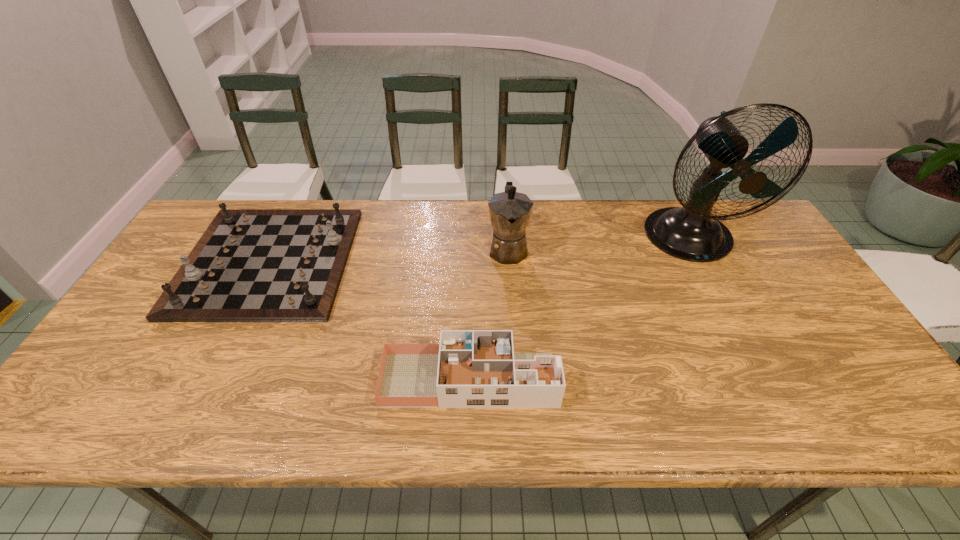
In the image, there is a desktop. Where is `vacant space at the right edge`? vacant space at the right edge is located at coordinates (791, 277).

Find the location of a particular element. This screenshot has width=960, height=540. free point between the chessboard and the fan is located at coordinates (479, 250).

You are a GUI agent. You are given a task and a screenshot of the screen. Output one action in this format:
    pyautogui.click(x=<x>, y=<y>)
    Task: Click on the unoccupied area between the dollhouse and the coffeepot
    The image size is (960, 540).
    Given the screenshot: What is the action you would take?
    pyautogui.click(x=489, y=314)

Locate an element on the screen. The image size is (960, 540). free space between the nearest object and the coffeepot is located at coordinates (489, 314).

You are a GUI agent. You are given a task and a screenshot of the screen. Output one action in this format:
    pyautogui.click(x=<x>, y=<y>)
    Task: Click on the unoccupied area between the rightmost object and the coffeepot
    This screenshot has width=960, height=540.
    Given the screenshot: What is the action you would take?
    (599, 244)

At what (x,y) coordinates should I click in order to perform the action: click on blank region between the dollhouse and the third shortest object. Please return your answer as a coordinate pair (x, y). The width and height of the screenshot is (960, 540). Looking at the image, I should click on (489, 314).

Locate an element on the screen. This screenshot has width=960, height=540. vacant area between the dollhouse and the rightmost object is located at coordinates (580, 309).

The height and width of the screenshot is (540, 960). I want to click on unoccupied position between the leftmost object and the tallest object, so click(479, 250).

This screenshot has height=540, width=960. What are the coordinates of `free spot between the fan and the second tallest object` in the screenshot? It's located at (599, 244).

The height and width of the screenshot is (540, 960). I want to click on vacant space in between the leftmost object and the nearest object, so click(369, 320).